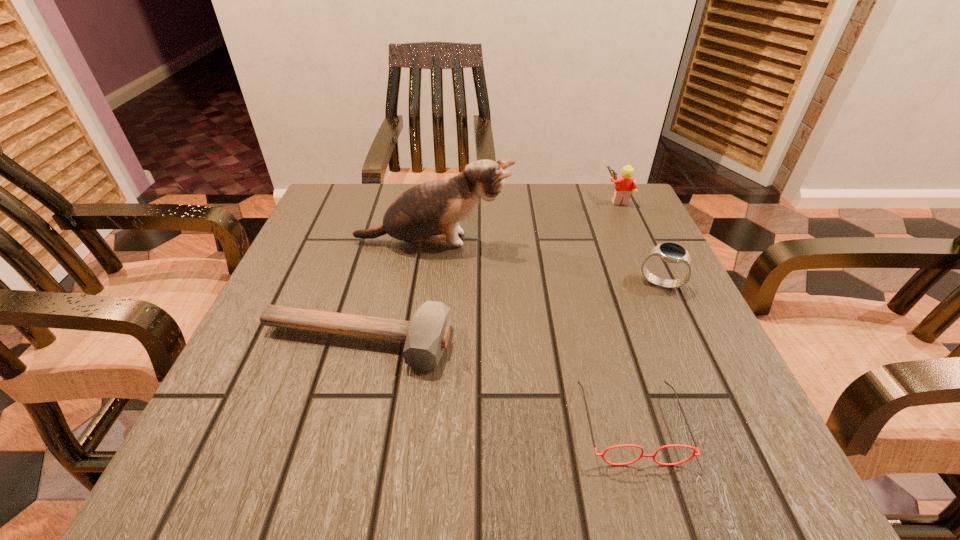
This screenshot has width=960, height=540. In order to click on free space located 0.400m in front of the Lego with the accessory visible in this screenshot , I will do `click(445, 199)`.

Find the location of a particular element. The height and width of the screenshot is (540, 960). vacant space situated in front of the Lego with the accessory visible is located at coordinates (486, 199).

The image size is (960, 540). Find the location of `free space located in front of the Lego with the accessory visible`. free space located in front of the Lego with the accessory visible is located at coordinates (525, 199).

Where is `free space located 0.270m on the back of the watch`? The image size is (960, 540). free space located 0.270m on the back of the watch is located at coordinates (624, 202).

Identify the location of free spot located 0.090m on the right of the mallet. (504, 343).

Identify the location of cat present at the far edge. (430, 212).

Locate an element on the screen. Image resolution: width=960 pixels, height=540 pixels. Lego positioned at the far edge is located at coordinates (625, 184).

Where is `object present at the near edge`? This screenshot has width=960, height=540. object present at the near edge is located at coordinates 627,445.

The width and height of the screenshot is (960, 540). I want to click on cat at the left edge, so click(x=430, y=212).

Where is `mallet positioned at the left edge`? The image size is (960, 540). mallet positioned at the left edge is located at coordinates (425, 337).